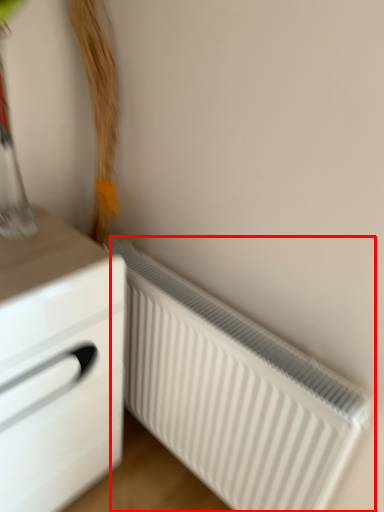
Question: Where is radiator (annotated by the red box) located in relation to chest of drawers in the image?

Choices:
 (A) left
 (B) right

Answer: (B)